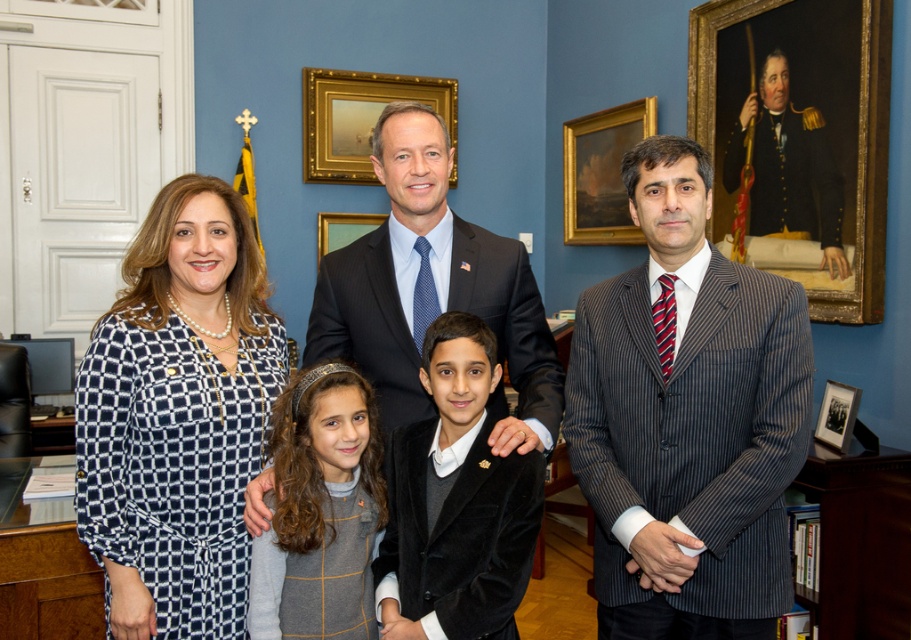
You are a photographer standing at the back of the office. You want to take a photo of the dark blue pinstripe suit at center and the goldwooden frame at upper center without moving any objects. Can you fit both subjects in your camera frame if your camera has a maximum field of view of 3 meters?

The distance between the dark blue pinstripe suit at center and the goldwooden frame at upper center is 2.96 meters. Since this distance is less than the camera field of view of 3 meters, both subjects can be captured in the same frame.

In the scene shown: You are standing in the office and need to find the dark blue pinstripe suit at center. According to the scene description, where should you look to locate it?

The dark blue pinstripe suit at center is located at point (370,321), so you should look there.